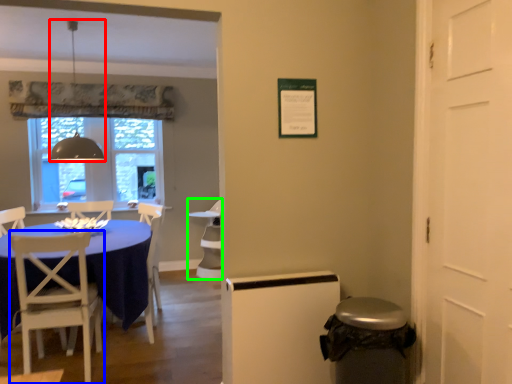
Question: Estimate the real-world distances between objects in this image. Which object is farther from lamp (highlighted by a red box), chair (highlighted by a blue box) or armchair (highlighted by a green box)?

Choices:
 (A) chair
 (B) armchair

Answer: (B)